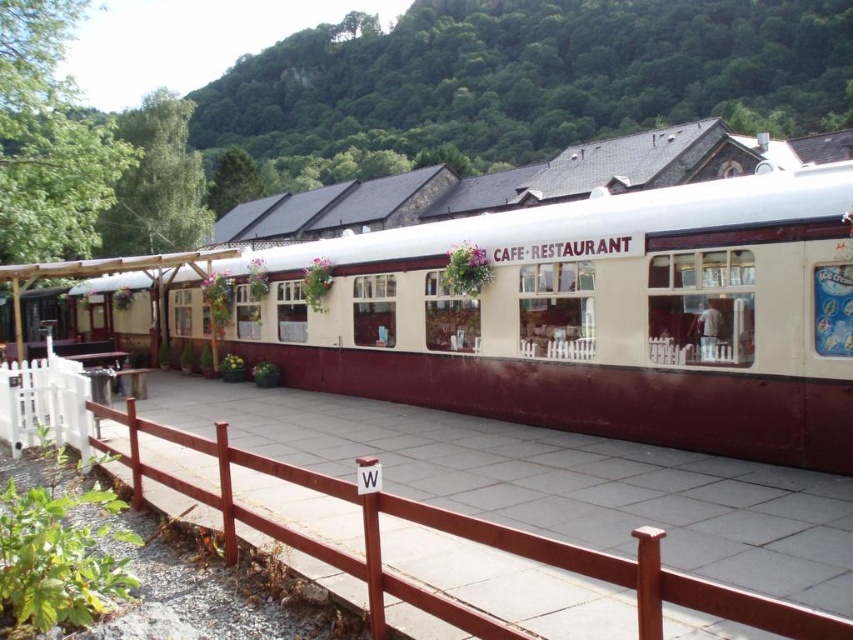
You are standing in front of the cafe and want to take a photo. You notice two points marked on the ground at coordinates point (497, 368) and point (628, 577). Which point is closer to your camera when taking the photo?

Point (628, 577) is closer to the camera because point (497, 368) is further away from the camera than point (628, 577).

You are a customer approaching the white matte train car at center and the brown wooden fence at center. Which one is closer to the entrance of the cafe? Please explain your reasoning based on their positions.

The white matte train car at center is closer to the entrance of the cafe because it is positioned on the left side of the brown wooden fence at center, implying it is nearer to the entrance area.

You are standing at the entrance of the CAFE RESTAURANT sign. You want to walk to the white matte train car at center. Which direction should you walk? Please respond with the shortest possible direction, such as north, south, etc., or a combination like northwest.

The white matte train car at center is located at point coordinates that are to the south of your current position at the entrance sign. Therefore, you should walk south.